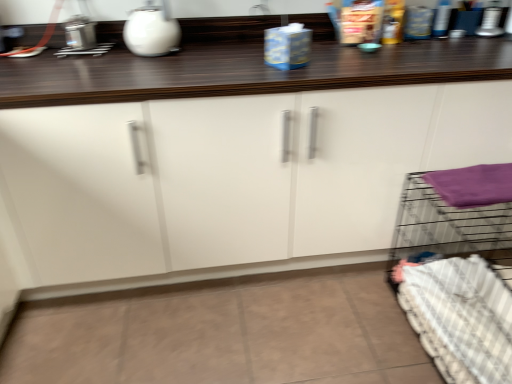
Question: Is point (486, 168) closer or farther from the camera than point (180, 205)?

Choices:
 (A) farther
 (B) closer

Answer: (B)

Question: Considering their positions, is purple fabric at right located in front of or behind white glossy cabinet at center?

Choices:
 (A) behind
 (B) front

Answer: (A)

Question: Which object is the farthest from the white glossy kettle at upper center?

Choices:
 (A) white checkered bedding at lower right
 (B) white glossy cabinet at center
 (C) purple fabric at right

Answer: (A)

Question: Considering the real-world distances, which object is farthest from the white glossy kettle at upper center?

Choices:
 (A) purple fabric at right
 (B) white glossy cabinet at center
 (C) white checkered bedding at lower right

Answer: (C)